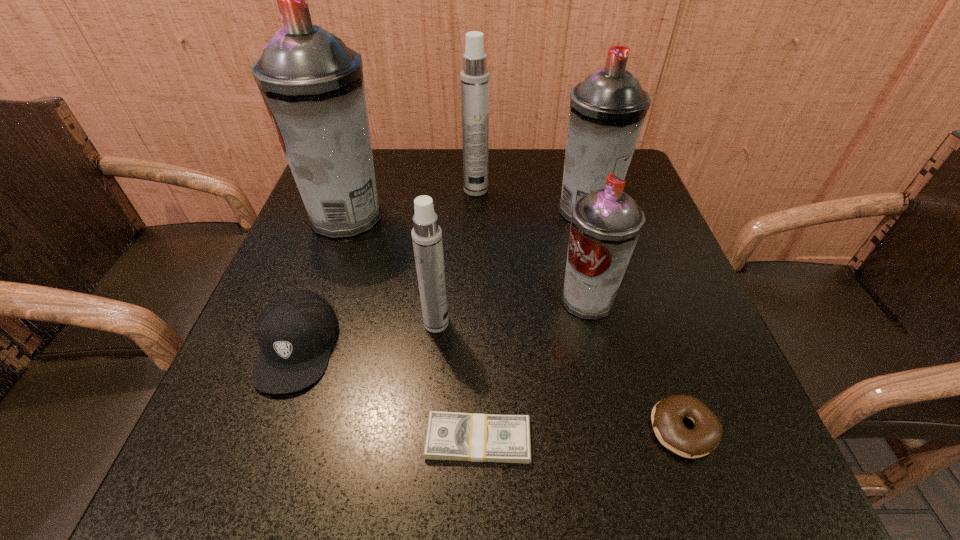
You are a GUI agent. You are given a task and a screenshot of the screen. Output one action in this format:
    pyautogui.click(x=<x>, y=<y>)
    Task: Click on the vacant point at the left edge
    
    Given the screenshot: What is the action you would take?
    click(253, 403)

Find the location of a particular element. Image resolution: width=960 pixels, height=540 pixels. free space at the right edge of the desktop is located at coordinates (695, 322).

Find the location of a particular element. Image resolution: width=960 pixels, height=540 pixels. vacant space at the near left corner is located at coordinates point(250,501).

Locate an element on the screen. This screenshot has height=540, width=960. free region at the far right corner of the desktop is located at coordinates (630, 179).

This screenshot has width=960, height=540. Find the location of `free space at the near right corner of the desktop`. free space at the near right corner of the desktop is located at coordinates (722, 454).

Where is `empty space between the third aerosol can from right to left and the smallest gray aerosol can`? empty space between the third aerosol can from right to left and the smallest gray aerosol can is located at coordinates (532, 245).

The width and height of the screenshot is (960, 540). I want to click on free spot between the left white aerosol can and the shortest object, so click(x=457, y=381).

Find the location of `free space that is in between the bigger white aerosol can and the second biggest gray aerosol can`. free space that is in between the bigger white aerosol can and the second biggest gray aerosol can is located at coordinates (531, 200).

Identify the location of vacant area that lies between the nearest gray aerosol can and the brown doughnut. (635, 364).

The width and height of the screenshot is (960, 540). Identify the location of free spot between the second shortest object and the leftmost gray aerosol can. (515, 323).